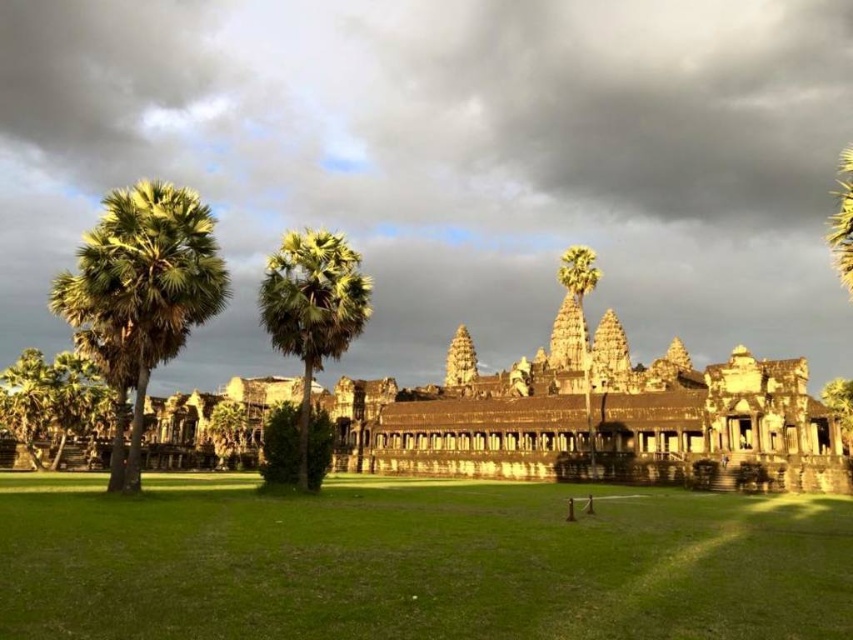
Is green leafy palm tree at left below green leafy bush at center?

Incorrect, green leafy palm tree at left is not positioned below green leafy bush at center.

How far apart are green leafy palm tree at left and green leafy bush at center?

green leafy palm tree at left and green leafy bush at center are 27.45 meters apart.

Is point (119, 230) behind point (271, 460)?

No, it is not.

Identify the location of green leafy palm tree at left. The height and width of the screenshot is (640, 853). (141, 294).

Between green leafy palm tree at center and green leafy bush at center, which one appears on the left side from the viewer's perspective?

green leafy bush at center

In the scene shown: Is green leafy palm tree at center shorter than green leafy bush at center?

Incorrect, green leafy palm tree at center's height does not fall short of green leafy bush at center's.

Who is more forward, (328,323) or (289,426)?

Point (328,323) is in front.

Identify the location of green leafy palm tree at center. (312, 307).

Does point (445, 506) lie behind point (287, 266)?

No, (445, 506) is in front of (287, 266).

This screenshot has height=640, width=853. What do you see at coordinates (421, 563) in the screenshot?
I see `green grass at center` at bounding box center [421, 563].

Is point (309, 532) positioned before point (312, 352)?

Yes.

The height and width of the screenshot is (640, 853). I want to click on green grass at center, so click(x=421, y=563).